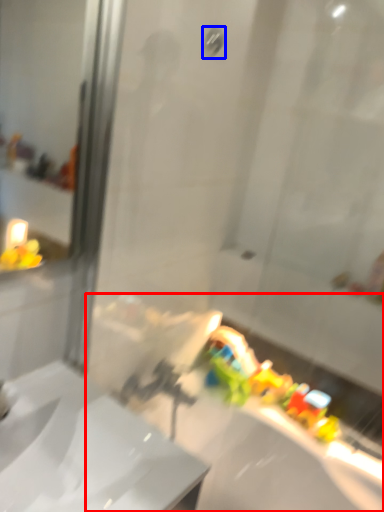
Question: Which point is further to the camera, bath (highlighted by a red box) or shower (highlighted by a blue box)?

Choices:
 (A) bath
 (B) shower

Answer: (B)